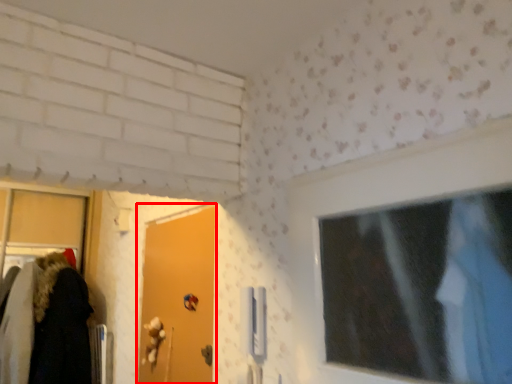
Question: From the image's perspective, where is door (annotated by the red box) located in relation to door handle in the image?

Choices:
 (A) above
 (B) below

Answer: (A)